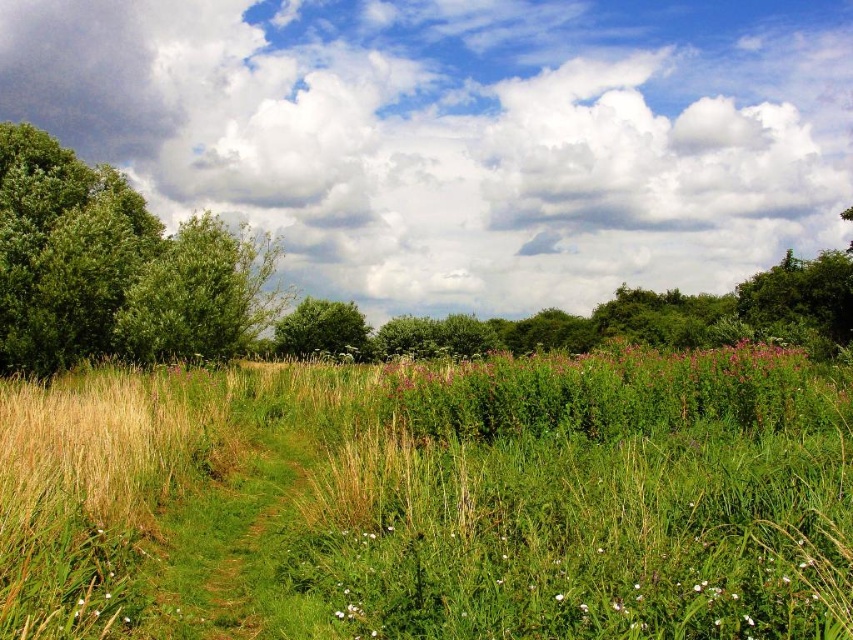
Question: Considering the real-world distances, which object is closest to the green leafy tree at left?

Choices:
 (A) purple matte flowers at center
 (B) green leafy tree at center

Answer: (A)

Question: Does green leafy tree at left have a greater width compared to purple matte flowers at center?

Choices:
 (A) no
 (B) yes

Answer: (B)

Question: Does green leafy tree at left have a lesser width compared to green leafy tree at center?

Choices:
 (A) yes
 (B) no

Answer: (B)

Question: Is purple matte flowers at center above green leafy tree at center?

Choices:
 (A) no
 (B) yes

Answer: (B)

Question: Which object appears closest to the camera in this image?

Choices:
 (A) green leafy tree at center
 (B) green leafy tree at left

Answer: (B)

Question: Among these points, which one is nearest to the camera?

Choices:
 (A) (772, 348)
 (B) (10, 353)
 (C) (308, 348)

Answer: (A)